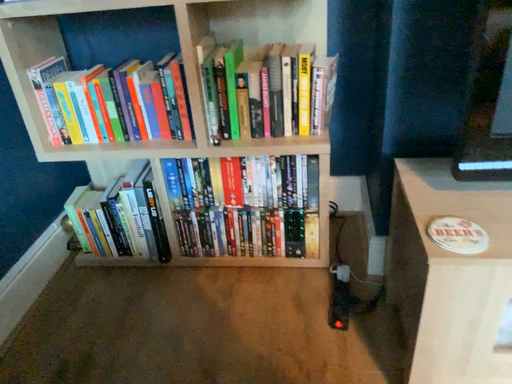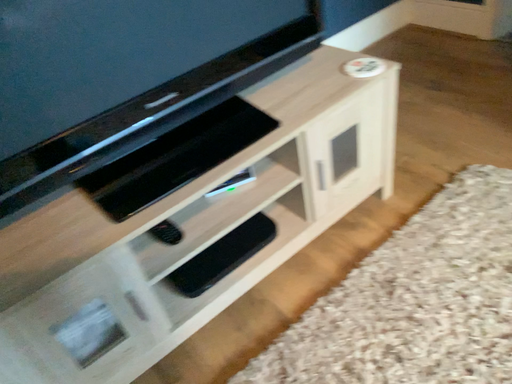
Question: How did the camera likely rotate when shooting the video?

Choices:
 (A) rotated right
 (B) rotated left

Answer: (A)